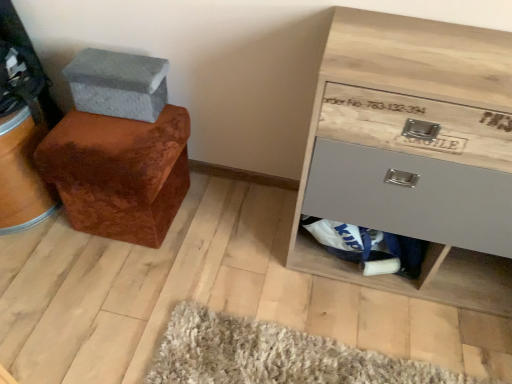
Question: Is point (106, 72) positioned closer to the camera than point (349, 243)?

Choices:
 (A) farther
 (B) closer

Answer: (B)

Question: In terms of size, does gray fabric shoe box at upper left appear bigger or smaller than matte gray drawer at lower right?

Choices:
 (A) small
 (B) big

Answer: (A)

Question: Estimate the real-world distances between objects in this image. Which object is closer to the matte gray drawer at lower right?

Choices:
 (A) gray fabric shoe box at upper left
 (B) velvet brown ottoman at left
 (C) wooden chest of drawers at lower right

Answer: (C)

Question: Which object is positioned farthest from the matte gray drawer at lower right?

Choices:
 (A) wooden chest of drawers at lower right
 (B) velvet brown ottoman at left
 (C) gray fabric shoe box at upper left

Answer: (C)